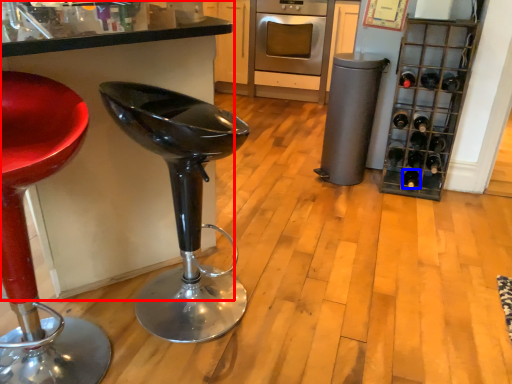
Question: Among these objects, which one is nearest to the camera, cabinetry (highlighted by a red box) or wine bottle (highlighted by a blue box)?

Choices:
 (A) cabinetry
 (B) wine bottle

Answer: (A)